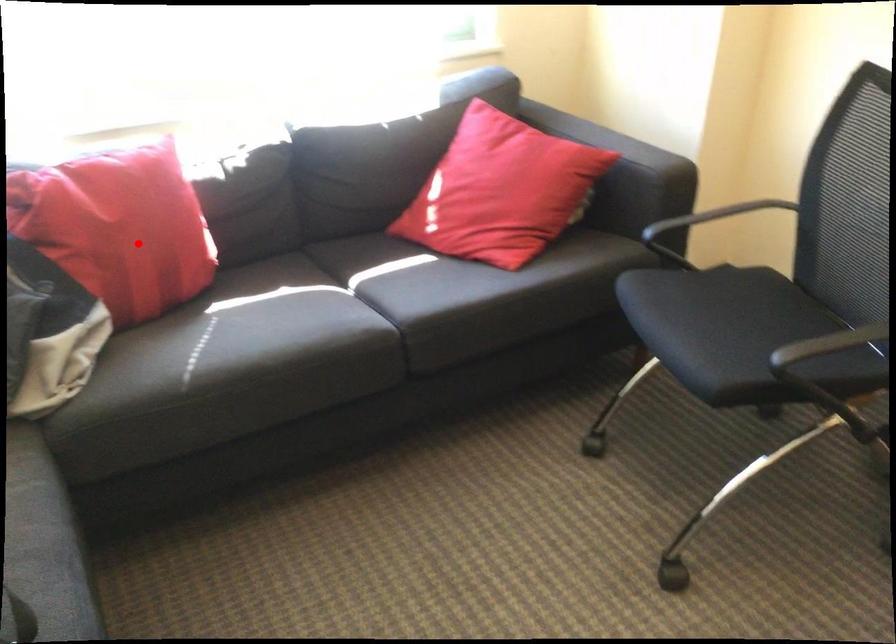
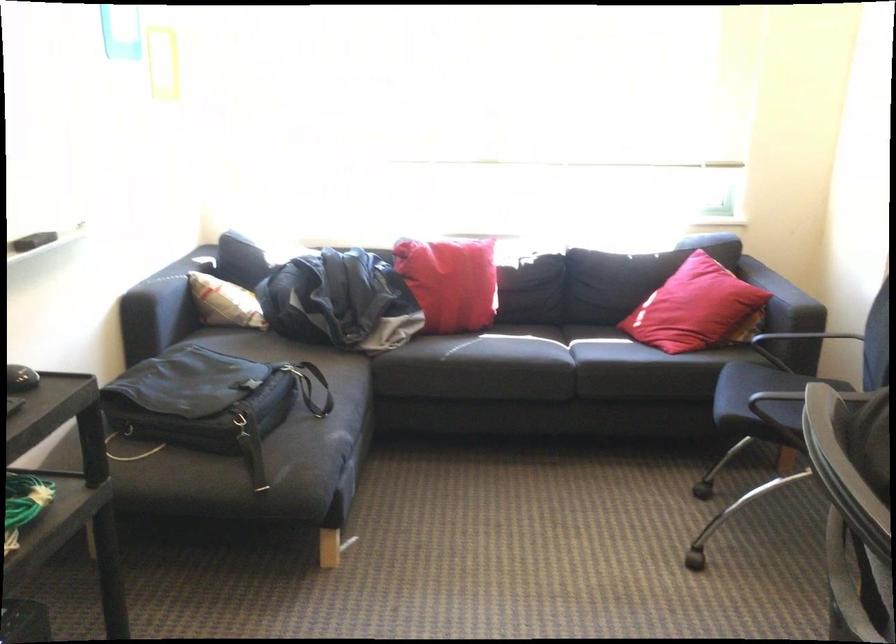
Question: I am providing you with two images of the same scene from different viewpoints. In image1, a red point is highlighted. Considering the same 3D point in image2, which of the following is correct?

Choices:
 (A) It is closer
 (B) It is farther

Answer: (B)